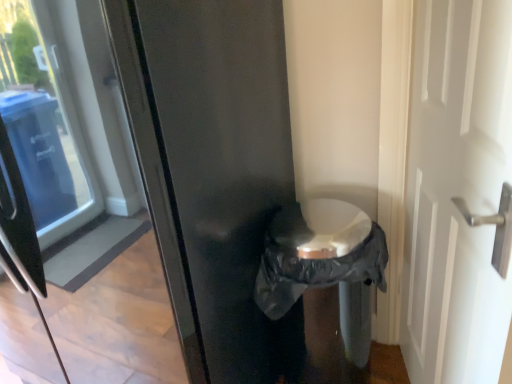
This screenshot has width=512, height=384. I want to click on white glossy door at right, so 456,191.

What is the approximate height of black plastic bag at center?

It is 28.27 inches.

Locate an element on the screen. The width and height of the screenshot is (512, 384). white glossy door at right is located at coordinates (456, 191).

Is white glossy door at right shorter than matte black refrigerator at center?

Indeed, white glossy door at right has a lesser height compared to matte black refrigerator at center.

Which object is more forward, white glossy door at right or matte black refrigerator at center?

Positioned in front is white glossy door at right.

Considering the positions of points (481, 62) and (16, 86), is point (481, 62) farther from camera compared to point (16, 86)?

No, it is not.

From the image's perspective, is white glossy door at right under matte black refrigerator at center?

Indeed, from the image's perspective, white glossy door at right is shown beneath matte black refrigerator at center.

Looking at this image, considering the positions of objects black plastic bag at center and matte black refrigerator at center in the image provided, who is in front, black plastic bag at center or matte black refrigerator at center?

matte black refrigerator at center.

Based on the photo, is black plastic bag at center touching matte black refrigerator at center?

No, black plastic bag at center is not touching matte black refrigerator at center.

Based on their positions, is black plastic bag at center located to the left or right of matte black refrigerator at center?

black plastic bag at center is to the right of matte black refrigerator at center.

Consider the image. Is matte black refrigerator at center positioned in front of white glossy door at right?

No, the depth of matte black refrigerator at center is greater than that of white glossy door at right.

Who is bigger, matte black refrigerator at center or white glossy door at right?

matte black refrigerator at center is bigger.

From the picture: How many degrees apart are the facing directions of matte black refrigerator at center and white glossy door at right?

They differ by 116 degrees in their facing directions.

In the image, there is a matte black refrigerator at center. At what (x,y) coordinates should I click in order to perform the action: click on door below it (from the image's perspective). Please return your answer as a coordinate pair (x, y). Looking at the image, I should click on (456, 191).

At what (x,y) coordinates should I click in order to perform the action: click on garbage on the right of matte black refrigerator at center. Please return your answer as a coordinate pair (x, y). This screenshot has width=512, height=384. Looking at the image, I should click on (324, 264).

Which of these two, matte black refrigerator at center or black plastic bag at center, is wider?

Wider between the two is matte black refrigerator at center.

Consider the image. From the image's perspective, relative to black plastic bag at center, is matte black refrigerator at center above or below?

matte black refrigerator at center is above black plastic bag at center.

Is point (119, 247) closer to camera compared to point (288, 248)?

Yes, point (119, 247) is closer to viewer.

Is white glossy door at right inside the boundaries of black plastic bag at center, or outside?

white glossy door at right is located beyond the bounds of black plastic bag at center.

Is white glossy door at right at the right side of black plastic bag at center?

Indeed, white glossy door at right is positioned on the right side of black plastic bag at center.

From a real-world perspective, is white glossy door at right physically located above or below black plastic bag at center?

white glossy door at right is situated higher than black plastic bag at center in the real world.

Is white glossy door at right placed right next to black plastic bag at center?

They are not placed beside each other.

Is black plastic bag at center positioned before white glossy door at right?

No, the depth of black plastic bag at center is greater than that of white glossy door at right.

From the image's perspective, which is below, black plastic bag at center or white glossy door at right?

From the image's view, black plastic bag at center is below.

Who is taller, black plastic bag at center or white glossy door at right?

With more height is white glossy door at right.

Locate an element on the screen. Image resolution: width=512 pixels, height=384 pixels. door to the right of matte black refrigerator at center is located at coordinates (456, 191).

The height and width of the screenshot is (384, 512). I want to click on garbage behind the matte black refrigerator at center, so click(324, 264).

Looking at the image, which one is located closer to black plastic bag at center, matte black refrigerator at center or white glossy door at right?

white glossy door at right is closer to black plastic bag at center.

Based on their spatial positions, is white glossy door at right or black plastic bag at center closer to matte black refrigerator at center?

The object closer to matte black refrigerator at center is black plastic bag at center.

Looking at the image, which one is located further to white glossy door at right, black plastic bag at center or matte black refrigerator at center?

The object further to white glossy door at right is matte black refrigerator at center.

Based on their spatial positions, is matte black refrigerator at center or black plastic bag at center closer to white glossy door at right?

Among the two, black plastic bag at center is located nearer to white glossy door at right.

When comparing their distances from black plastic bag at center, does white glossy door at right or matte black refrigerator at center seem further?

The object further to black plastic bag at center is matte black refrigerator at center.

When comparing their distances from matte black refrigerator at center, does black plastic bag at center or white glossy door at right seem closer?

black plastic bag at center is positioned closer to the anchor matte black refrigerator at center.

This screenshot has height=384, width=512. Find the location of `garbage between matte black refrigerator at center and white glossy door at right from left to right`. garbage between matte black refrigerator at center and white glossy door at right from left to right is located at coordinates (324, 264).